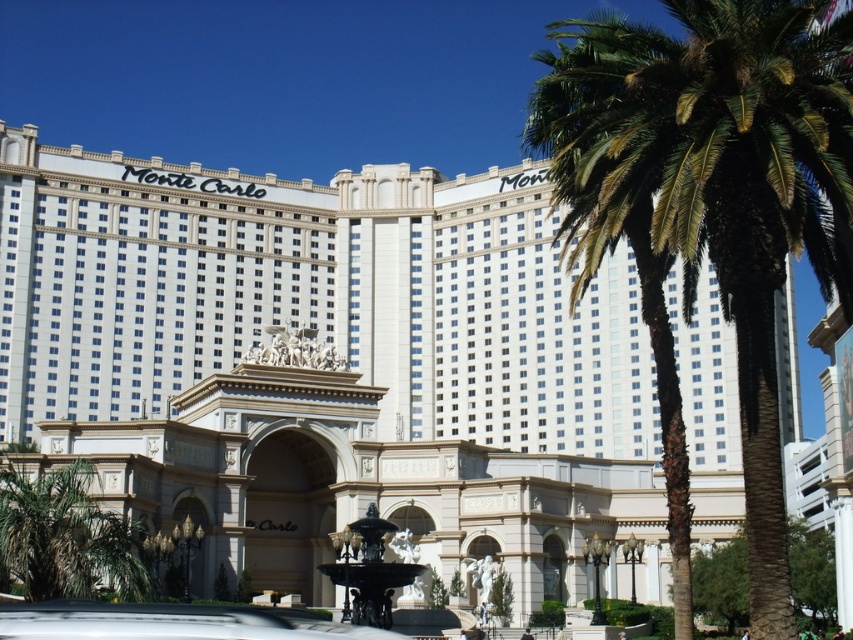
Question: Is green leafy palm at right bigger than metallic silver car at center?

Choices:
 (A) yes
 (B) no

Answer: (A)

Question: Which point is closer to the camera?

Choices:
 (A) black polished stone fountain at center
 (B) metallic silver car at center
 (C) white glossy building at center
 (D) green leafy palm at right

Answer: (B)

Question: Which object is positioned closest to the green leafy palm at right?

Choices:
 (A) metallic silver car at center
 (B) black polished stone fountain at center

Answer: (B)

Question: Which is nearer to the black polished stone fountain at center?

Choices:
 (A) white glossy building at center
 (B) green leafy palm at right
 (C) metallic silver car at center

Answer: (B)

Question: Is white glossy building at center thinner than green leafy palm at right?

Choices:
 (A) yes
 (B) no

Answer: (B)

Question: Can you confirm if white glossy building at center is bigger than green leafy palm at right?

Choices:
 (A) no
 (B) yes

Answer: (A)